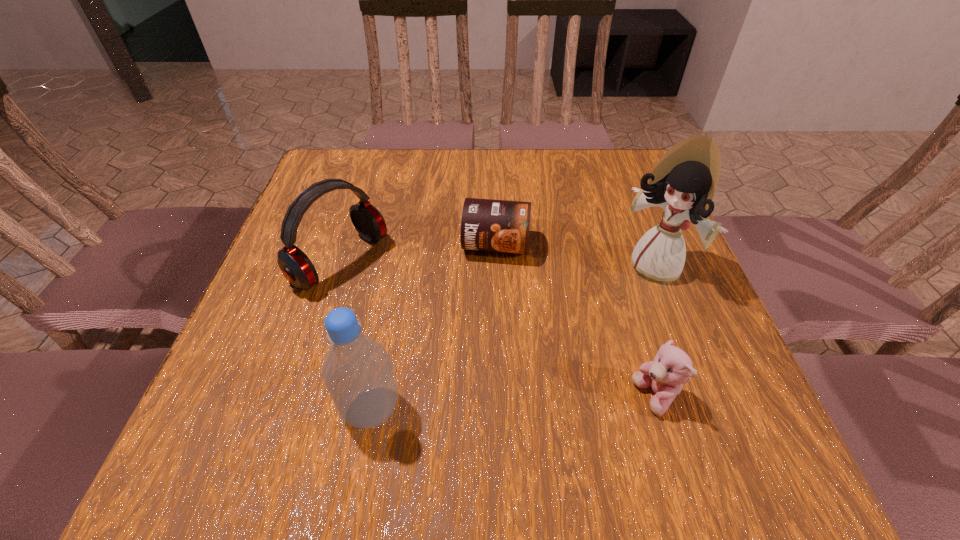
Where is `object at the left edge`? This screenshot has width=960, height=540. object at the left edge is located at coordinates (296, 267).

The image size is (960, 540). Identify the location of teddy bear that is at the right edge. point(671,368).

I want to click on doll that is at the right edge, so click(683, 182).

Identify the location of object that is at the near right corner. (671, 368).

The image size is (960, 540). I want to click on free spot at the far edge of the desktop, so click(x=578, y=160).

In the image, there is a desktop. At what (x,y) coordinates should I click in order to perform the action: click on blank space at the left edge. Please return your answer as a coordinate pair (x, y). The height and width of the screenshot is (540, 960). Looking at the image, I should click on (326, 239).

I want to click on vacant region at the right edge of the desktop, so click(652, 215).

Identify the location of vacant space at the far right corner. (610, 161).

Where is `free space that is in between the third object from left to right and the teddy bear`? free space that is in between the third object from left to right and the teddy bear is located at coordinates (575, 321).

You are a GUI agent. You are given a task and a screenshot of the screen. Output one action in this format:
    pyautogui.click(x=<x>, y=<y>)
    Task: Click on the vacant space that's between the doll and the bottle
    
    Given the screenshot: What is the action you would take?
    pyautogui.click(x=513, y=339)